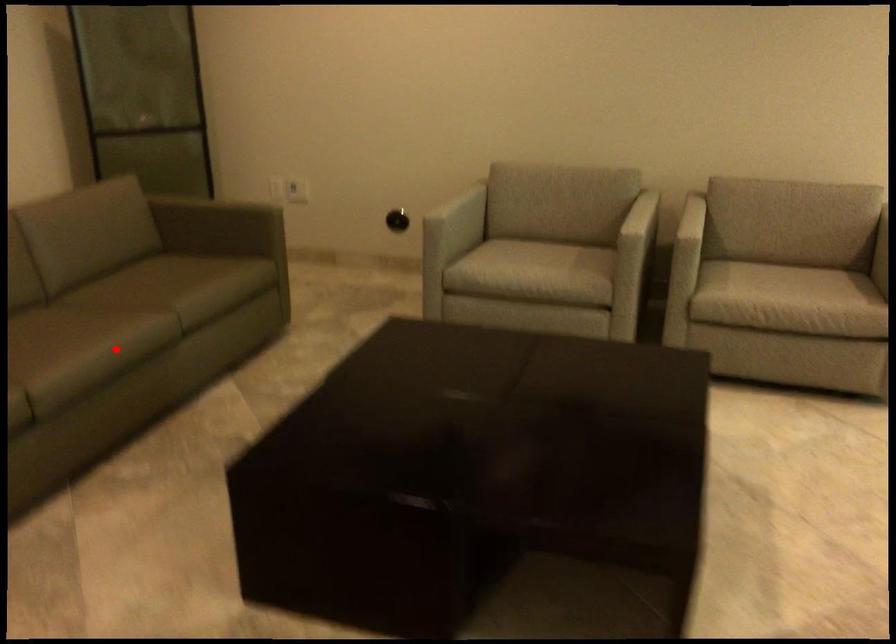
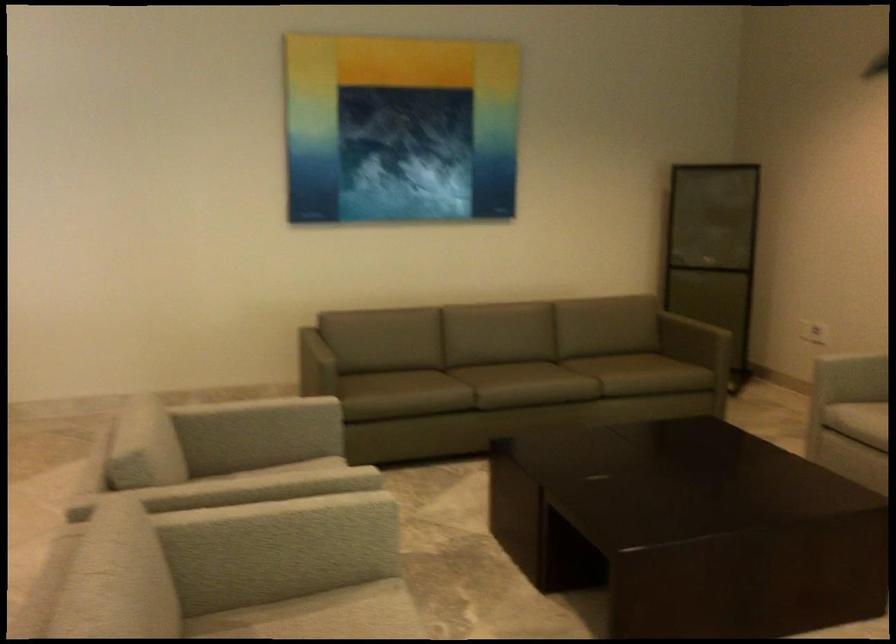
Find the pixel in the second image that matches the highlighted location in the first image.

(524, 384)